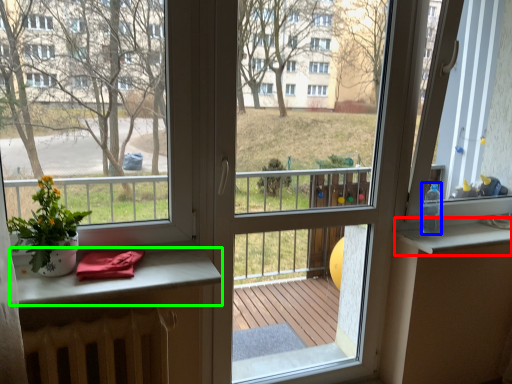
Question: Estimate the real-world distances between objects in this image. Which object is farther from window sill (highlighted by a red box), bottle (highlighted by a blue box) or table (highlighted by a green box)?

Choices:
 (A) bottle
 (B) table

Answer: (B)